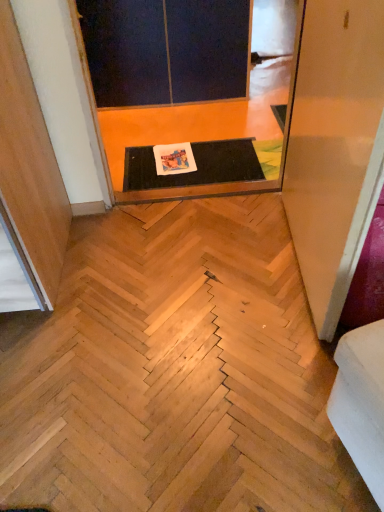
At what (x,y) coordinates should I click in order to perform the action: click on vacant position to the left of transparent plastic screen door at upper right, placed as the 3th screen door when sorted from back to front. Please return your answer as a coordinate pair (x, y). Looking at the image, I should click on (197, 269).